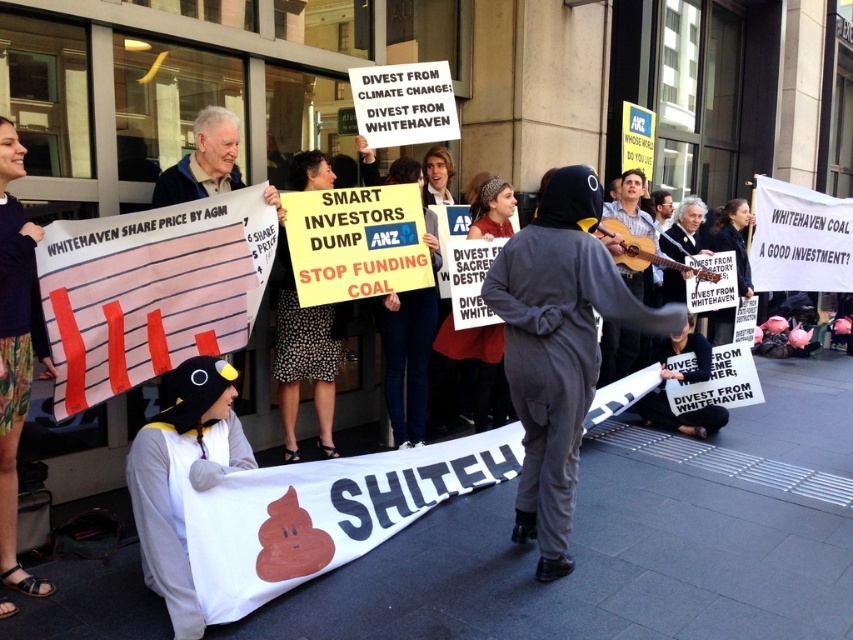
How far apart are gray penguin costume at lower left and floral skirt at lower left?

gray penguin costume at lower left is 23.91 inches from floral skirt at lower left.

Is point (202, 401) positioned before point (12, 564)?

Yes, it is in front of point (12, 564).

I want to click on gray penguin costume at lower left, so click(183, 476).

Who is more forward, (x=558, y=561) or (x=723, y=412)?

Point (x=558, y=561) is more forward.

What do you see at coordinates (558, 348) in the screenshot?
I see `gray fabric costume at center` at bounding box center [558, 348].

Who is more forward, (578, 436) or (654, 406)?

Point (578, 436) is more forward.

Locate an element on the screen. The width and height of the screenshot is (853, 640). gray fabric costume at center is located at coordinates (558, 348).

In the scene shown: Is floral skirt at lower left wider than black fabric sign at lower center?

Incorrect, floral skirt at lower left's width does not surpass black fabric sign at lower center's.

Which of these two, floral skirt at lower left or black fabric sign at lower center, stands shorter?

Standing shorter between the two is black fabric sign at lower center.

Which is behind, point (22, 314) or point (637, 412)?

Point (637, 412)

At what (x,y) coordinates should I click in order to perform the action: click on floral skirt at lower left. Please return your answer as a coordinate pair (x, y). The image size is (853, 640). Looking at the image, I should click on (15, 349).